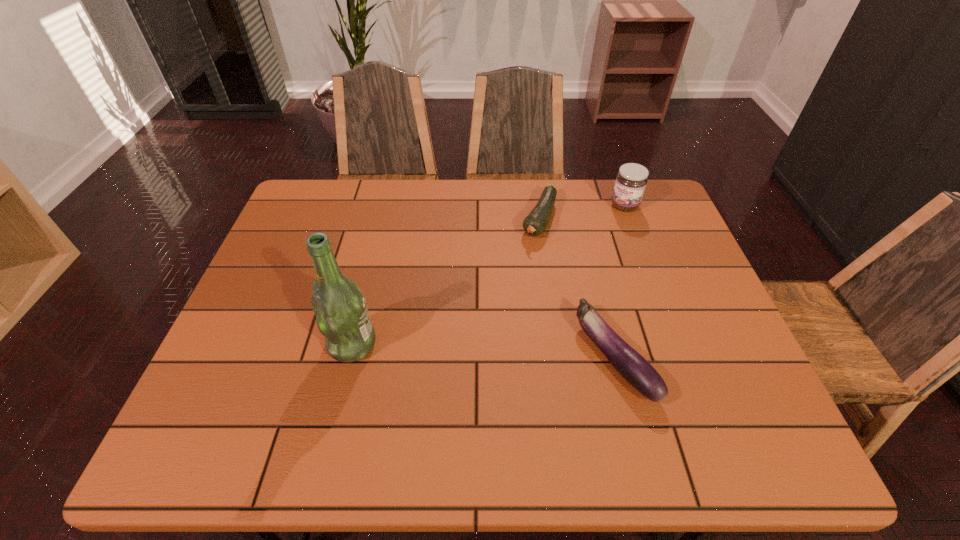
Find the location of `beer bottle`. beer bottle is located at coordinates (342, 316).

Find the location of a particular element. This screenshot has height=540, width=960. the tallest object is located at coordinates (342, 316).

The image size is (960, 540). Find the location of `eggplant`. eggplant is located at coordinates (634, 368).

At what (x,y) coordinates should I click in order to perform the action: click on zucchini. Please return your answer as a coordinate pair (x, y). The image size is (960, 540). Looking at the image, I should click on (535, 223).

Locate an element on the screen. Image resolution: width=960 pixels, height=540 pixels. the second tallest object is located at coordinates (631, 180).

The width and height of the screenshot is (960, 540). I want to click on the rightmost object, so click(x=631, y=180).

In order to click on vacant space located on the surface of the leftmost object in this screenshot , I will do `click(239, 345)`.

What are the coordinates of `free region located on the surface of the leftmost object` in the screenshot? It's located at (257, 345).

Locate an element on the screen. This screenshot has height=540, width=960. vacant space located on the surface of the leftmost object is located at coordinates (293, 345).

I want to click on blank space located 0.170m on the right of the eggplant, so click(x=726, y=357).